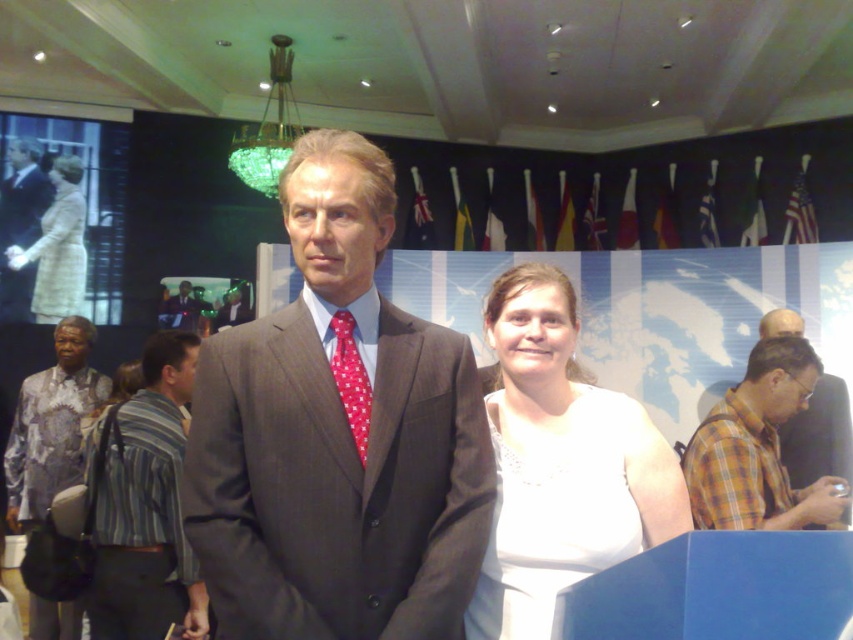
You are a photographer at the event and need to adjust the lighting to ensure both the white satin dress at center and the light beige wool coat at left are well lit. Based on their positions, which one is closer to the floor?

The white satin dress at center is below light beige wool coat at left, so it is closer to the floor.

You are at an event and want to take a photo of the matte brown suit at center and the plaid shirt at right. Since you want both subjects to be in focus, which one should you focus on first?

You should focus on the matte brown suit at center first because it is closer to you than the plaid shirt at right, ensuring both are in focus when using depth of field.